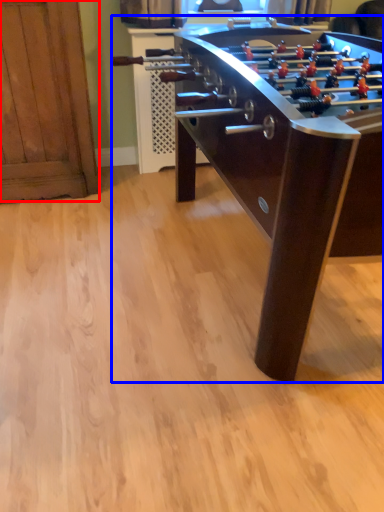
Question: Which object appears farthest to the camera in this image, furniture (highlighted by a red box) or table (highlighted by a blue box)?

Choices:
 (A) furniture
 (B) table

Answer: (A)